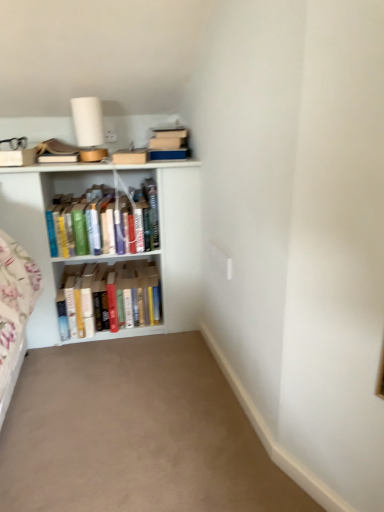
Question: Is hardcover books at center, arranged as the first book when viewed from the top, oriented away from white wooden bookshelf at left?

Choices:
 (A) yes
 (B) no

Answer: (A)

Question: From the image's perspective, does hardcover books at center, which is counted as the 2th book, starting from the bottom, appear higher than white wooden bookshelf at left?

Choices:
 (A) no
 (B) yes

Answer: (B)

Question: Would you consider hardcover books at center, which is counted as the 2th book, starting from the bottom, to be distant from white wooden bookshelf at left?

Choices:
 (A) yes
 (B) no

Answer: (B)

Question: From the image's perspective, is hardcover books at center, which is counted as the 2th book, starting from the bottom, under white wooden bookshelf at left?

Choices:
 (A) yes
 (B) no

Answer: (B)

Question: Would you say hardcover books at center, arranged as the first book when viewed from the top, contains white wooden bookshelf at left?

Choices:
 (A) no
 (B) yes

Answer: (A)

Question: Is hardcover books at center, which is counted as the 2th book, starting from the bottom, placed right next to white wooden bookshelf at left?

Choices:
 (A) no
 (B) yes

Answer: (A)

Question: Is there a large distance between hardcover books at center, which appears as the first book when ordered from the bottom, and white wooden bookshelf at left?

Choices:
 (A) no
 (B) yes

Answer: (A)

Question: From a real-world perspective, is hardcover books at center, which is the 2th book from top to bottom, physically below white wooden bookshelf at left?

Choices:
 (A) yes
 (B) no

Answer: (A)

Question: Is hardcover books at center, which appears as the first book when ordered from the bottom, oriented towards white wooden bookshelf at left?

Choices:
 (A) yes
 (B) no

Answer: (A)

Question: Does hardcover books at center, which appears as the first book when ordered from the bottom, have a greater height compared to white wooden bookshelf at left?

Choices:
 (A) yes
 (B) no

Answer: (B)

Question: From the image's perspective, is hardcover books at center, which is the 2th book from top to bottom, below white wooden bookshelf at left?

Choices:
 (A) no
 (B) yes

Answer: (B)

Question: Is hardcover books at center, which is the 2th book from top to bottom, in front of white wooden bookshelf at left?

Choices:
 (A) yes
 (B) no

Answer: (B)

Question: Is hardcover books at center, which appears as the first book when ordered from the bottom, smaller than beige carpet at lower center?

Choices:
 (A) yes
 (B) no

Answer: (A)